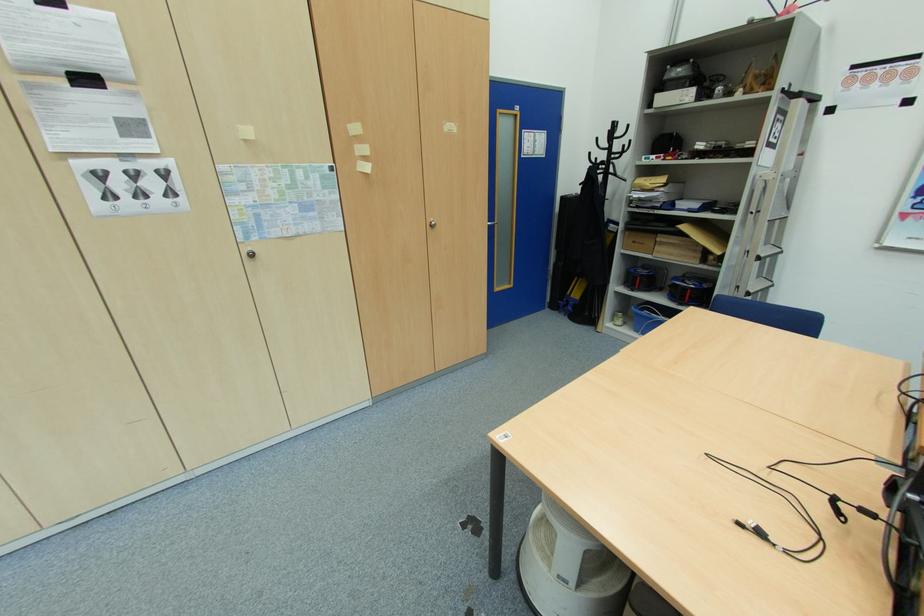
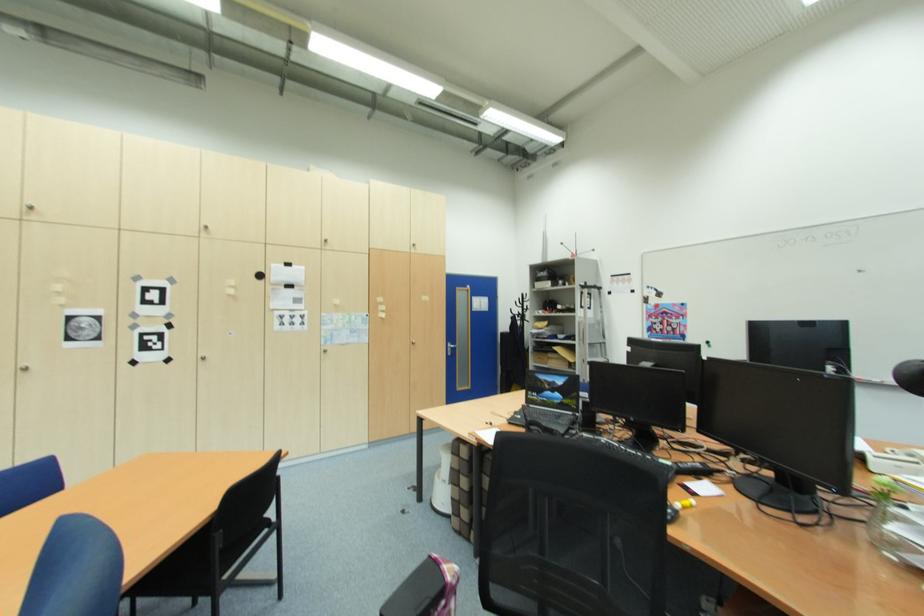
Question: What movement of the cameraman would produce the second image?

Choices:
 (A) Left
 (B) Right
 (C) Forward
 (D) Backward

Answer: (D)